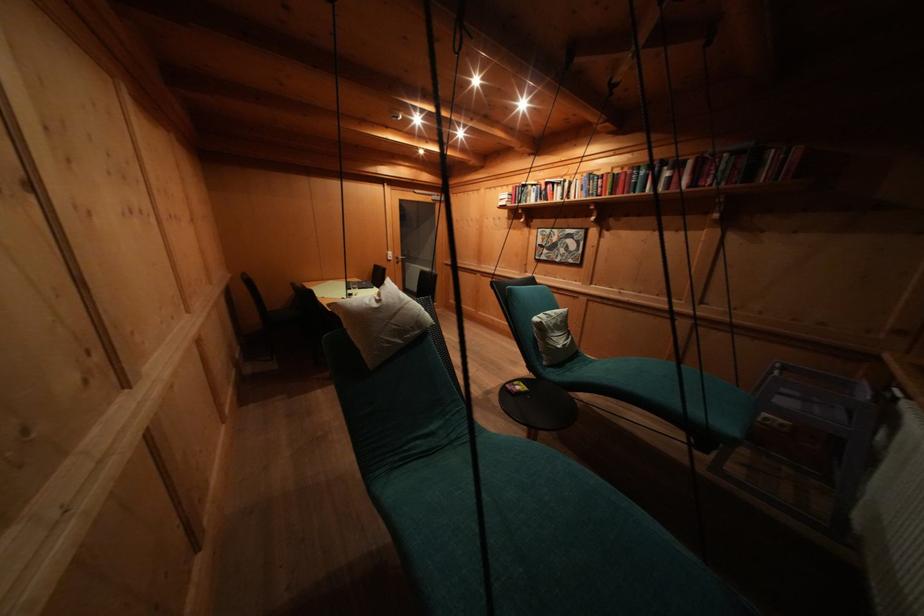
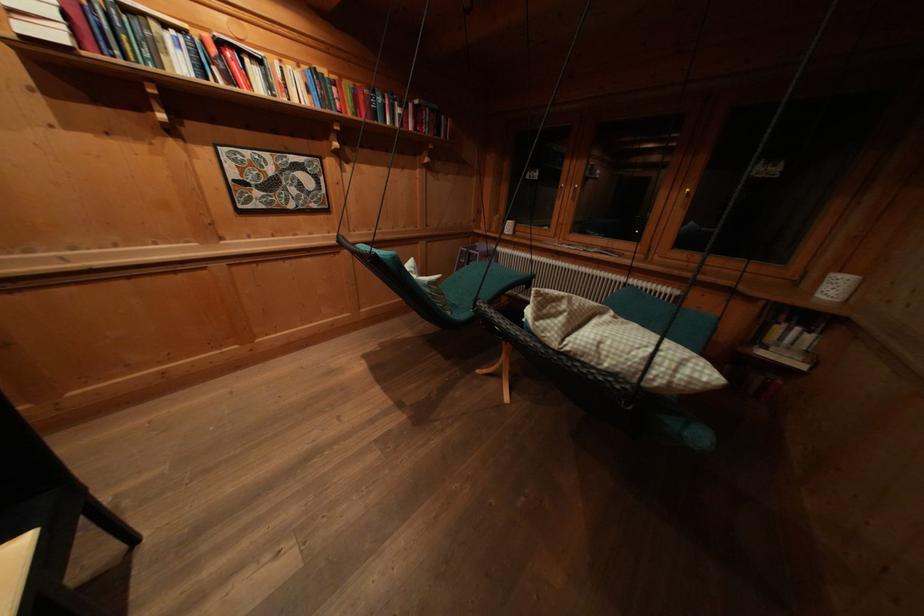
The point at (553, 188) is marked in the first image. Where is the corresponding point in the second image?

(225, 47)